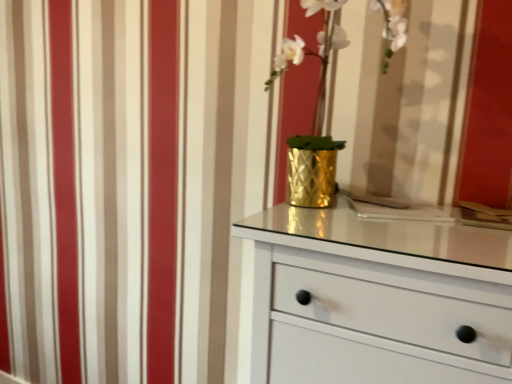
Describe the element at coordinates (313, 51) in the screenshot. The image size is (512, 384). I see `gold textured vase at center` at that location.

The image size is (512, 384). I want to click on gold textured vase at center, so click(x=313, y=51).

The image size is (512, 384). What are the coordinates of `gold textured vase at center` in the screenshot? It's located at (313, 51).